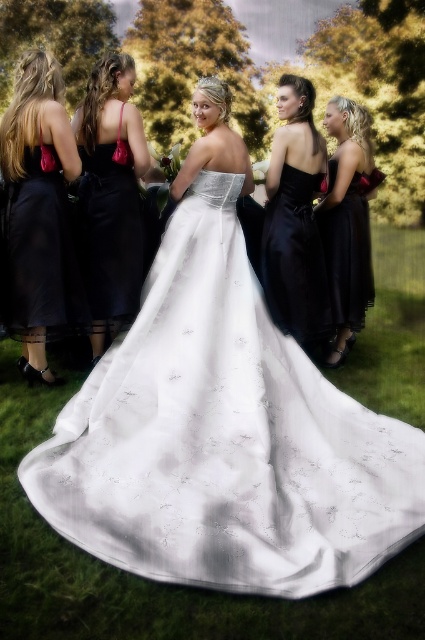
Between point (31, 188) and point (99, 292), which one is positioned behind?

Point (99, 292)

Does point (85, 305) come farther from viewer compared to point (93, 232)?

No.

At what (x,y) coordinates should I click in order to perform the action: click on satin white gown at center. Please return your answer as a coordinate pair (x, y). Looking at the image, I should click on (45, 220).

Is matte black dress at left below satin black dress at upper right?

Yes.

Which is more to the left, matte black dress at left or satin black dress at upper right?

Positioned to the left is matte black dress at left.

Locate an element on the screen. Image resolution: width=425 pixels, height=640 pixels. matte black dress at left is located at coordinates (37, 212).

Where is `matte black dress at left`? This screenshot has height=640, width=425. matte black dress at left is located at coordinates (37, 212).

Who is more forward, (192, 262) or (65, 272)?

Point (192, 262)

I want to click on white satin dress at center, so click(x=223, y=436).